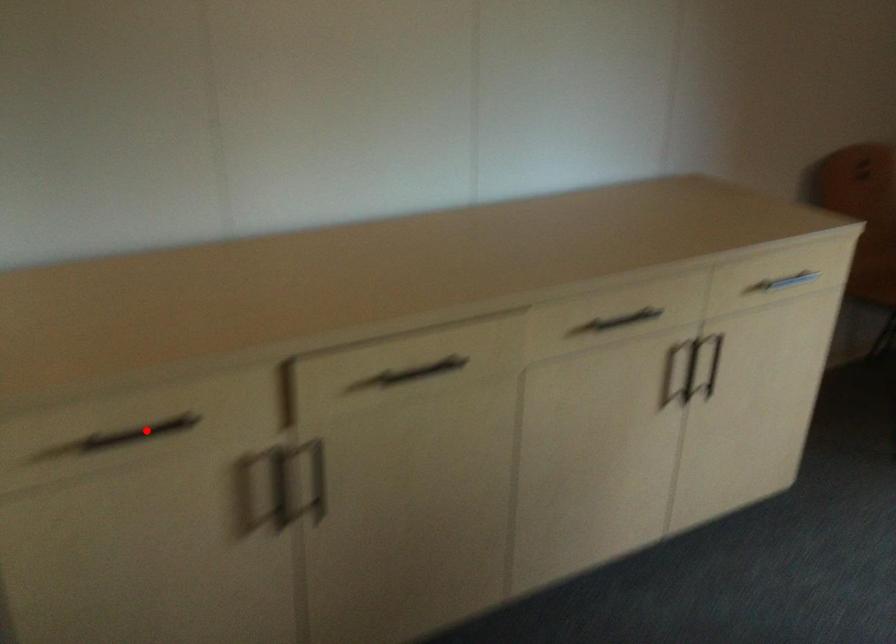
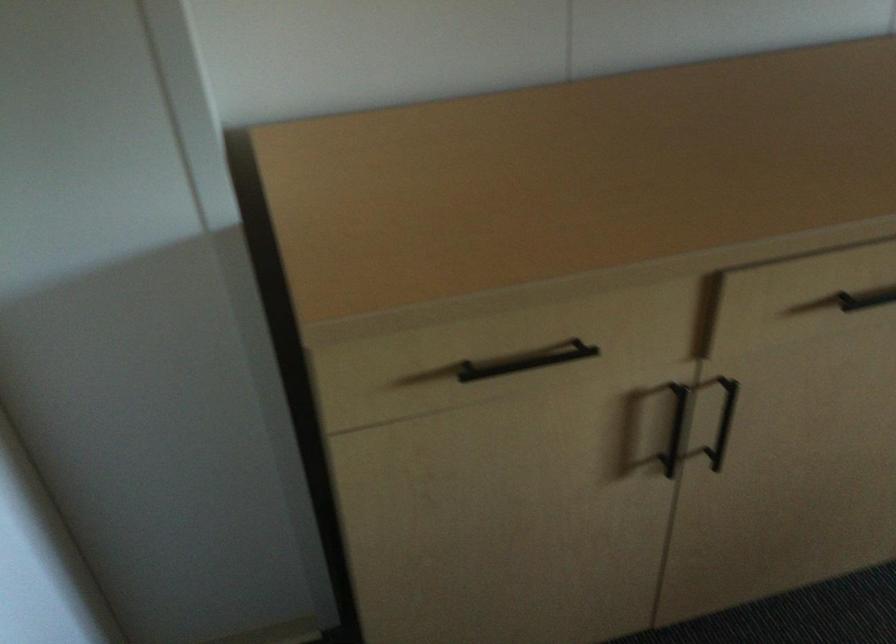
Question: I am providing you with two images of the same scene from different viewpoints. A red point is shown in image1. For the corresponding object point in image2, is it positioned nearer or farther from the camera?

Choices:
 (A) Nearer
 (B) Farther

Answer: (A)